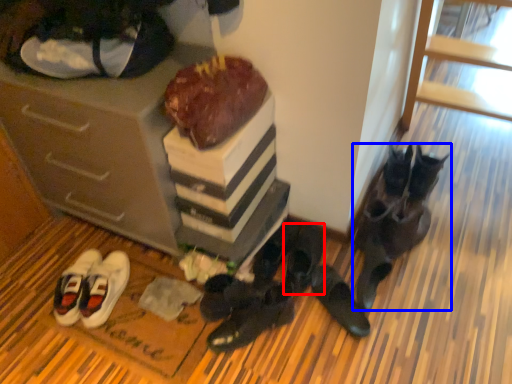
Question: Which object is further to the camera taking this photo, footwear (highlighted by a red box) or footwear (highlighted by a blue box)?

Choices:
 (A) footwear
 (B) footwear

Answer: (A)